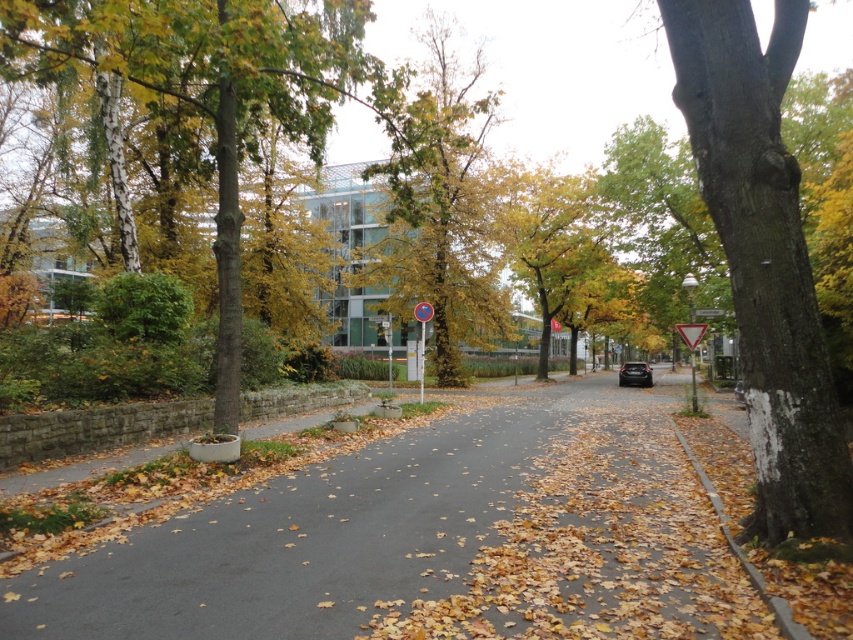
You are standing at the point with coordinates point [647,378] and want to walk to the point with coordinates point [775,106]. Which direction should you face to move towards your destination?

You should face north because point [775,106] is in front of point [647,378], indicating it is north of your current position.